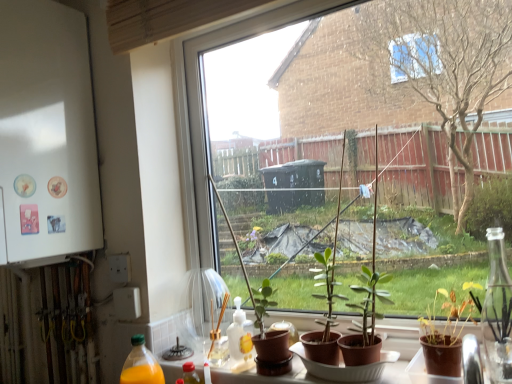
Question: Looking at their shapes, would you say brown matte pot at lower right, placed as the first houseplant when sorted from front to back, is wider or thinner than white matte refrigerator at left?

Choices:
 (A) wide
 (B) thin

Answer: (B)

Question: Is brown matte pot at lower right, which is counted as the 1th houseplant, starting from the right, in front of or behind white matte refrigerator at left in the image?

Choices:
 (A) behind
 (B) front

Answer: (B)

Question: Estimate the real-world distances between objects in this image. Which object is closer to the brown matte pot at lower right, the 2th houseplant positioned from the back?

Choices:
 (A) transparent glass window at center
 (B) white matte refrigerator at left
 (C) green matte plant at center, marked as the second houseplant in a right-to-left arrangement

Answer: (C)

Question: Estimate the real-world distances between objects in this image. Which object is farther from the green matte plant at center, marked as the second houseplant in a right-to-left arrangement?

Choices:
 (A) transparent glass window at center
 (B) brown matte pot at lower right, placed as the first houseplant when sorted from front to back
 (C) white matte refrigerator at left

Answer: (C)